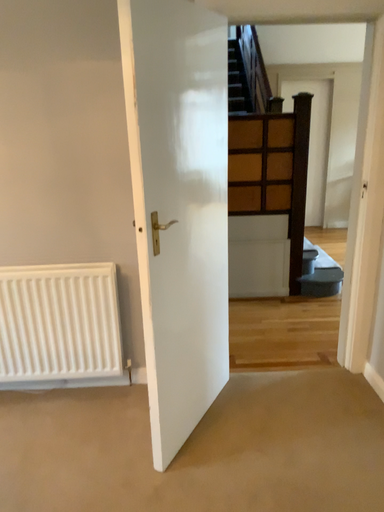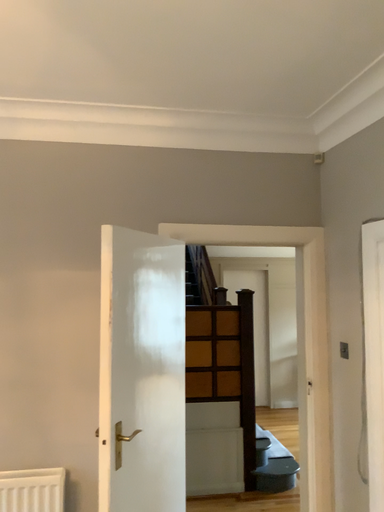
Question: Which way did the camera rotate in the video?

Choices:
 (A) rotated right
 (B) rotated left

Answer: (A)